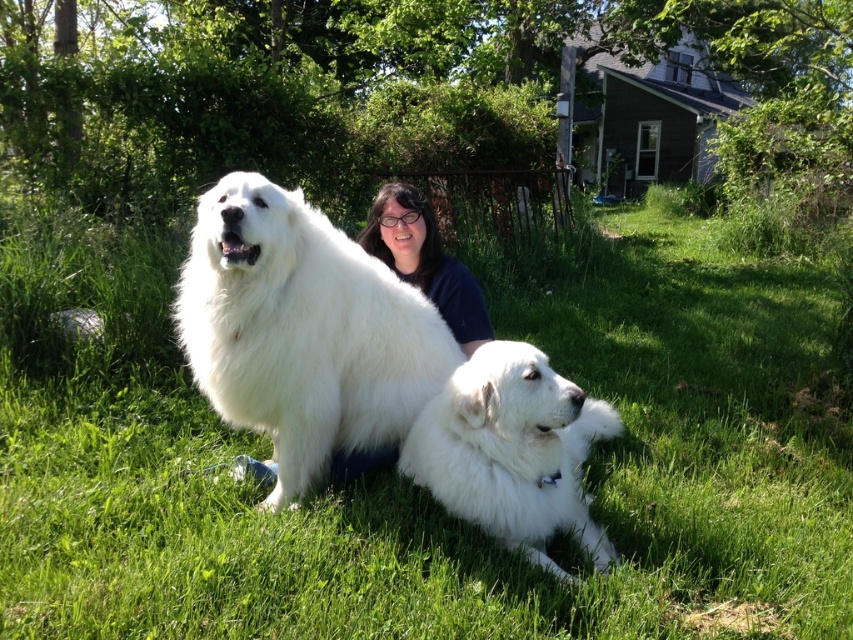
Is point (195, 296) less distant than point (538, 376)?

That is False.

Between point (292, 364) and point (463, 376), which one is positioned in front?

Point (463, 376)

Identify the location of white fluffy dog at center. (302, 332).

Between green grass at center and white fluffy dog at center, which one is positioned higher?

white fluffy dog at center is higher up.

Measure the distance between green grass at center and white fluffy dog at center.

They are 35.97 inches apart.

Which is in front, point (120, 378) or point (389, 364)?

Positioned in front is point (389, 364).

This screenshot has height=640, width=853. I want to click on green grass at center, so click(x=440, y=508).

Is white fluffy dog at center to the left of dark blue shirt at center from the viewer's perspective?

Yes, white fluffy dog at center is to the left of dark blue shirt at center.

Which of these two, white fluffy dog at center or dark blue shirt at center, stands taller?

With more height is white fluffy dog at center.

Between point (318, 429) and point (416, 225), which one is positioned behind?

Point (416, 225)

At what (x,y) coordinates should I click in order to perform the action: click on white fluffy dog at center. Please return your answer as a coordinate pair (x, y). The image size is (853, 640). Looking at the image, I should click on (302, 332).